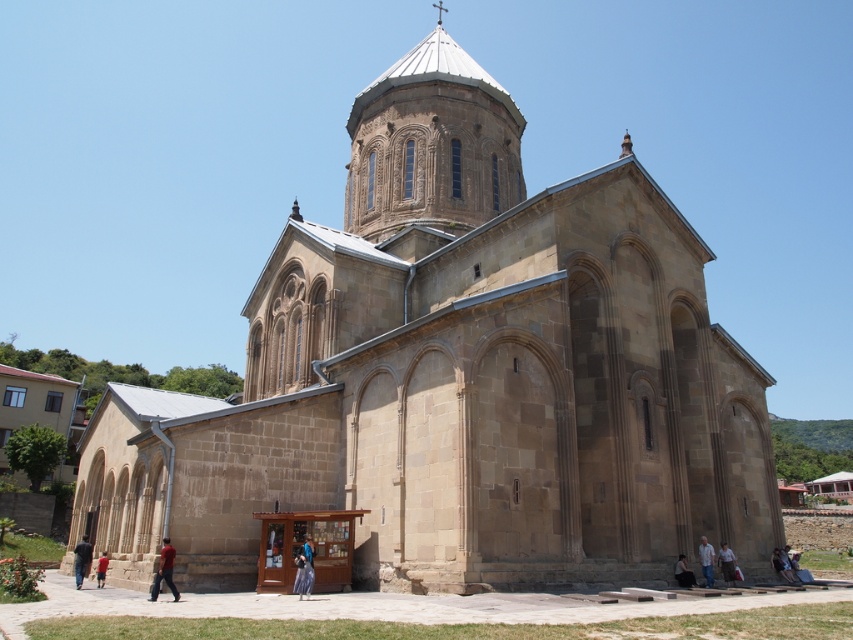
Who is more forward, [701,568] or [97,563]?

Positioned in front is point [701,568].

Is light blue fabric shirt at lower right bigger than red cotton shirt at lower left?

Yes, light blue fabric shirt at lower right is bigger than red cotton shirt at lower left.

Is point (701, 547) closer to viewer compared to point (99, 563)?

No, (701, 547) is further to viewer.

Where is `light blue fabric shirt at lower right`? The height and width of the screenshot is (640, 853). light blue fabric shirt at lower right is located at coordinates (706, 561).

This screenshot has width=853, height=640. Describe the element at coordinates (305, 570) in the screenshot. I see `blue denim jeans at lower center` at that location.

Who is more forward, (x=305, y=566) or (x=780, y=556)?

Point (x=305, y=566)

Who is more distant from viewer, [309,566] or [793,568]?

Positioned behind is point [793,568].

Locate an element on the screen. The image size is (853, 640). blue denim jeans at lower center is located at coordinates (305, 570).

Can you confirm if dark blue jeans at lower right is positioned to the left of dark gray stone person at lower center?

Incorrect, dark blue jeans at lower right is not on the left side of dark gray stone person at lower center.

Who is lower down, dark blue jeans at lower right or dark gray stone person at lower center?

dark blue jeans at lower right is below.

Image resolution: width=853 pixels, height=640 pixels. I want to click on dark blue jeans at lower right, so click(782, 564).